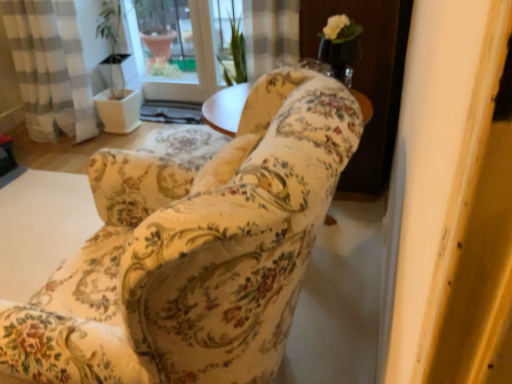
Question: Is floral fabric chair at center far from white glossy screen door at upper center?

Choices:
 (A) yes
 (B) no

Answer: (A)

Question: From the image's perspective, is floral fabric chair at center located above white glossy screen door at upper center?

Choices:
 (A) yes
 (B) no

Answer: (B)

Question: Is floral fabric chair at center positioned behind white glossy screen door at upper center?

Choices:
 (A) yes
 (B) no

Answer: (B)

Question: Can you confirm if floral fabric chair at center is shorter than white glossy screen door at upper center?

Choices:
 (A) no
 (B) yes

Answer: (A)

Question: From the image's perspective, is floral fabric chair at center under white glossy screen door at upper center?

Choices:
 (A) no
 (B) yes

Answer: (B)

Question: Considering the relative sizes of floral fabric chair at center and white glossy screen door at upper center in the image provided, is floral fabric chair at center smaller than white glossy screen door at upper center?

Choices:
 (A) yes
 (B) no

Answer: (B)

Question: Is white glossy screen door at upper center positioned behind floral fabric chair at center?

Choices:
 (A) yes
 (B) no

Answer: (A)

Question: From the image's perspective, is white glossy screen door at upper center below floral fabric chair at center?

Choices:
 (A) no
 (B) yes

Answer: (A)

Question: Does white glossy screen door at upper center have a lesser width compared to floral fabric chair at center?

Choices:
 (A) no
 (B) yes

Answer: (B)

Question: Is white glossy screen door at upper center smaller than floral fabric chair at center?

Choices:
 (A) no
 (B) yes

Answer: (B)

Question: From the image's perspective, is white glossy screen door at upper center above floral fabric chair at center?

Choices:
 (A) no
 (B) yes

Answer: (B)

Question: Considering the relative positions of white glossy screen door at upper center and floral fabric chair at center in the image provided, is white glossy screen door at upper center to the right of floral fabric chair at center from the viewer's perspective?

Choices:
 (A) yes
 (B) no

Answer: (A)

Question: From a real-world perspective, is white glossy screen door at upper center above or below floral fabric chair at center?

Choices:
 (A) below
 (B) above

Answer: (B)